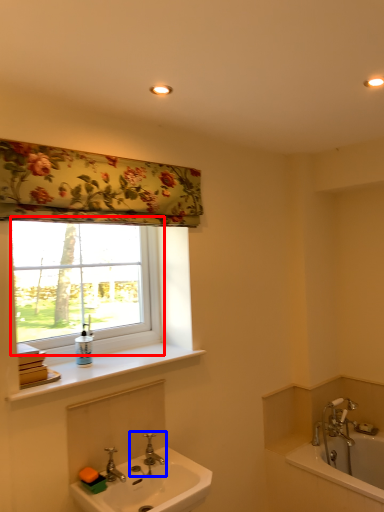
Question: Among these objects, which one is farthest to the camera, window (highlighted by a red box) or tap (highlighted by a blue box)?

Choices:
 (A) window
 (B) tap

Answer: (A)